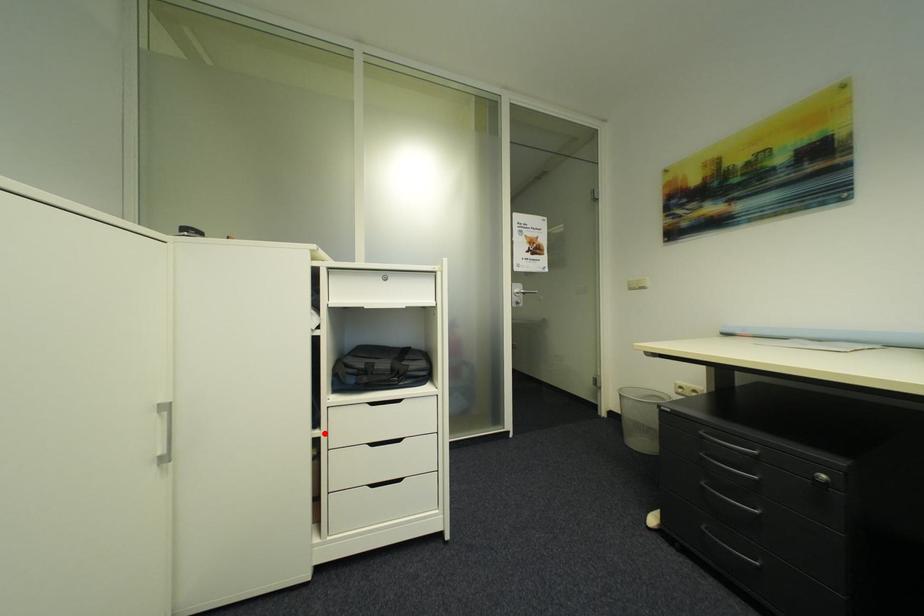
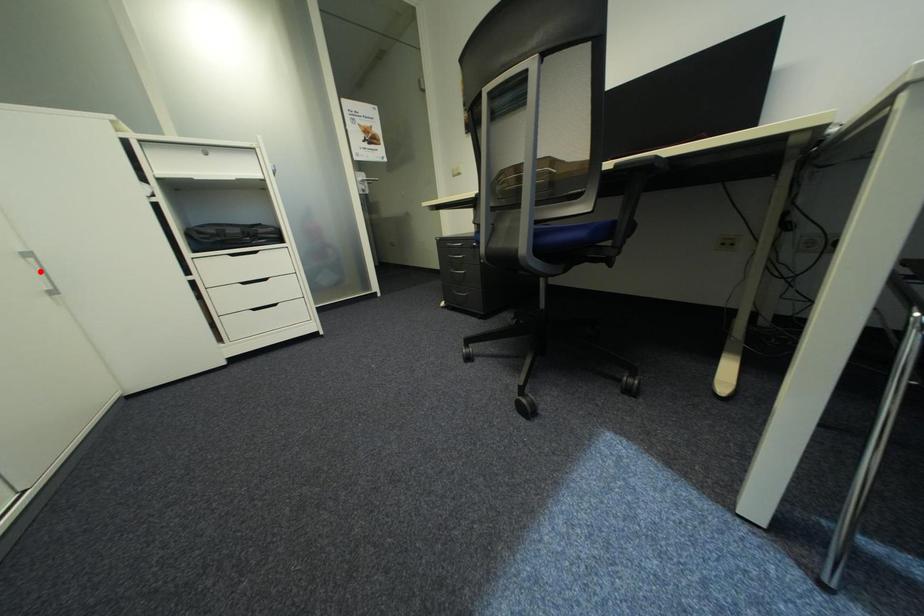
I am providing you with two images of the same scene from different viewpoints. A red point is marked on the first image and another point is marked on the second image. Do the highlighted points in image1 and image2 indicate the same real-world spot?

No